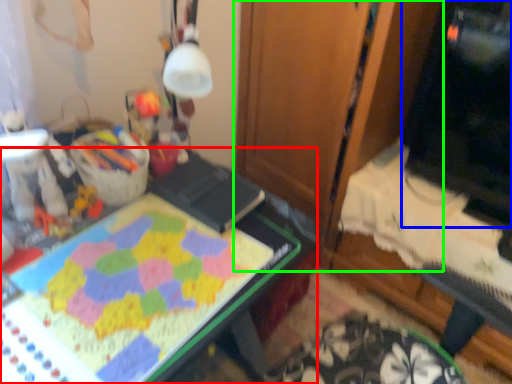
Question: Considering the real-world distances, which object is farthest from desk (highlighted by a red box)? computer monitor (highlighted by a blue box) or dresser (highlighted by a green box)?

Choices:
 (A) computer monitor
 (B) dresser

Answer: (A)